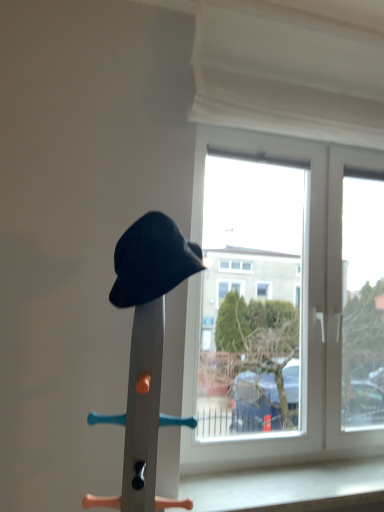
Question: Is matte black hat at center wider or thinner than matte black hat at center?

Choices:
 (A) wide
 (B) thin

Answer: (A)

Question: Is matte black hat at center in front of or behind matte black hat at center in the image?

Choices:
 (A) behind
 (B) front

Answer: (B)

Question: Which object is positioned farthest from the white fabric curtain at upper center?

Choices:
 (A) matte black hat at center
 (B) transparent glass window at center
 (C) matte black hat at center

Answer: (A)

Question: Estimate the real-world distances between objects in this image. Which object is farther from the white fabric curtain at upper center?

Choices:
 (A) transparent glass window at center
 (B) matte black hat at center
 (C) matte black hat at center

Answer: (C)